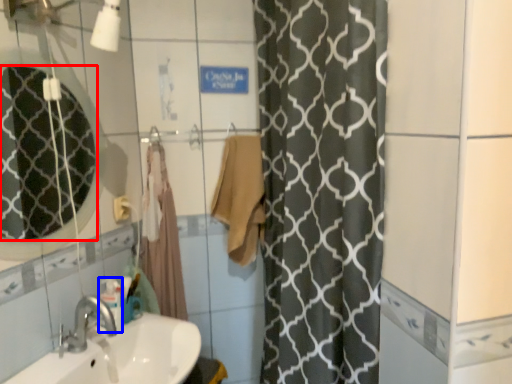
Question: Which object is further to the camera taking this photo, mirror (highlighted by a red box) or toiletry (highlighted by a blue box)?

Choices:
 (A) mirror
 (B) toiletry

Answer: (B)